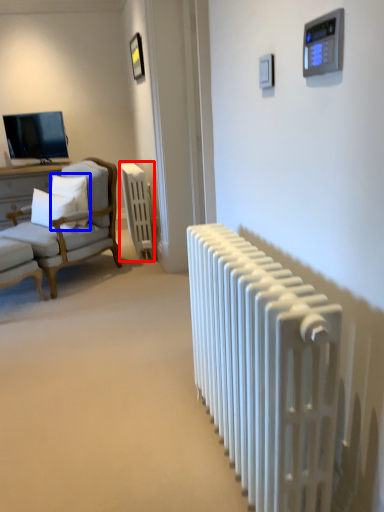
Question: Among these objects, which one is farthest to the camera, radiator (highlighted by a red box) or pillow (highlighted by a blue box)?

Choices:
 (A) radiator
 (B) pillow

Answer: (A)